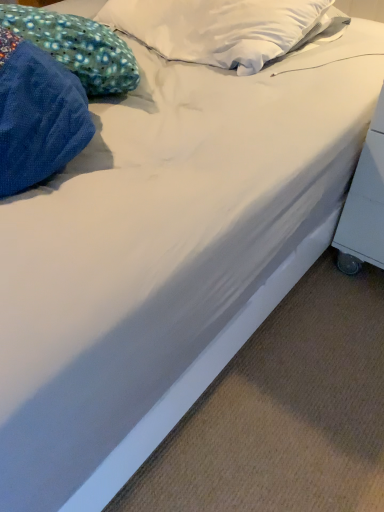
Question: In terms of size, does blue dotted fabric pillow at upper left appear bigger or smaller than white plastic table at lower right?

Choices:
 (A) big
 (B) small

Answer: (A)

Question: From the image's perspective, relative to white plastic table at lower right, is blue dotted fabric pillow at upper left above or below?

Choices:
 (A) above
 (B) below

Answer: (A)

Question: Is blue dotted fabric pillow at upper left situated inside white plastic table at lower right or outside?

Choices:
 (A) inside
 (B) outside

Answer: (B)

Question: From the image's perspective, is white plastic table at lower right above or below blue dotted fabric pillow at upper left?

Choices:
 (A) above
 (B) below

Answer: (B)

Question: Looking at the image, does white plastic table at lower right seem bigger or smaller compared to blue dotted fabric pillow at upper left?

Choices:
 (A) small
 (B) big

Answer: (A)

Question: Is point pyautogui.click(x=354, y=175) positioned closer to the camera than point pyautogui.click(x=89, y=30)?

Choices:
 (A) farther
 (B) closer

Answer: (A)

Question: In terms of width, does white plastic table at lower right look wider or thinner when compared to blue dotted fabric pillow at upper left?

Choices:
 (A) wide
 (B) thin

Answer: (A)